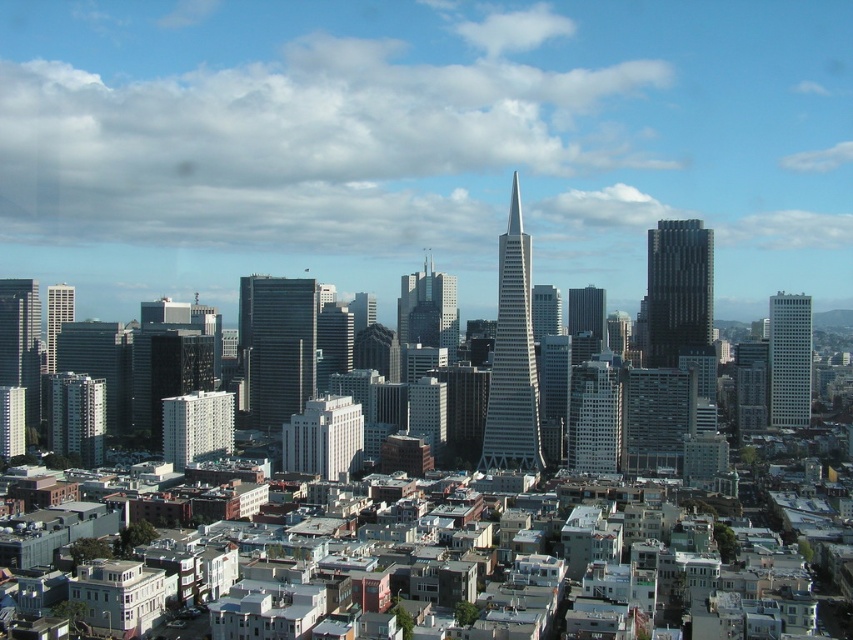
Does white glass skyscraper at right appear on the left side of matte glass skyscraper at center?

In fact, white glass skyscraper at right is to the right of matte glass skyscraper at center.

Is point (792, 355) behind point (437, 333)?

That is True.

Identify the location of white glass skyscraper at right. (788, 358).

Describe the element at coordinates (677, 289) in the screenshot. I see `dark gray glass skyscraper at right` at that location.

Who is positioned more to the right, dark gray glass skyscraper at right or matte glass skyscraper at left?

Positioned to the right is dark gray glass skyscraper at right.

Is point (648, 352) less distant than point (48, 301)?

Yes, it is.

Locate an element on the screen. Image resolution: width=853 pixels, height=640 pixels. dark gray glass skyscraper at right is located at coordinates (677, 289).

Does white glass skyscraper at right have a smaller size compared to matte glass skyscraper at center-right?

Incorrect, white glass skyscraper at right is not smaller in size than matte glass skyscraper at center-right.

Which is more to the left, white glass skyscraper at right or matte glass skyscraper at center-right?

matte glass skyscraper at center-right is more to the left.

Is point (810, 321) in front of point (605, 337)?

No, (810, 321) is further to viewer.

Identify the location of white glass skyscraper at right. (788, 358).